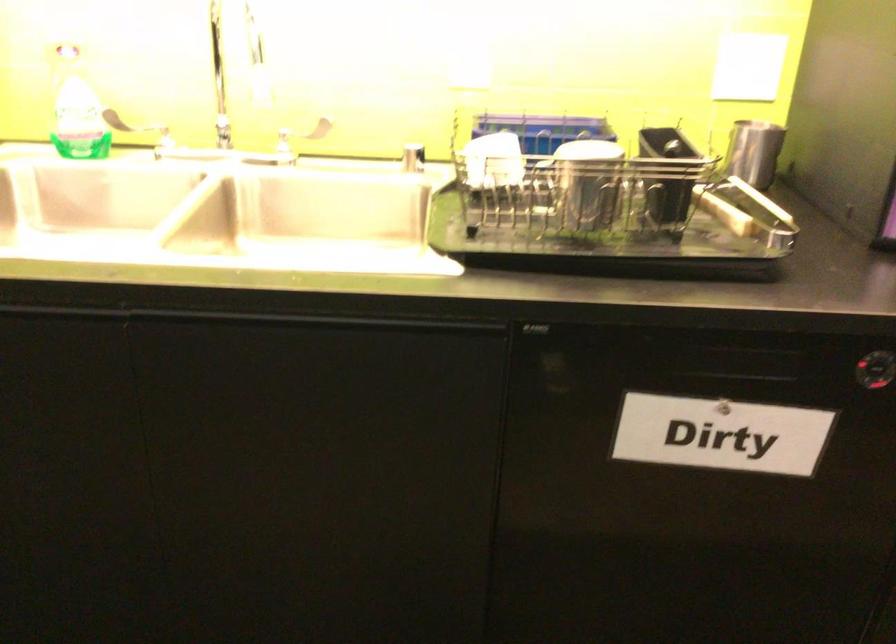
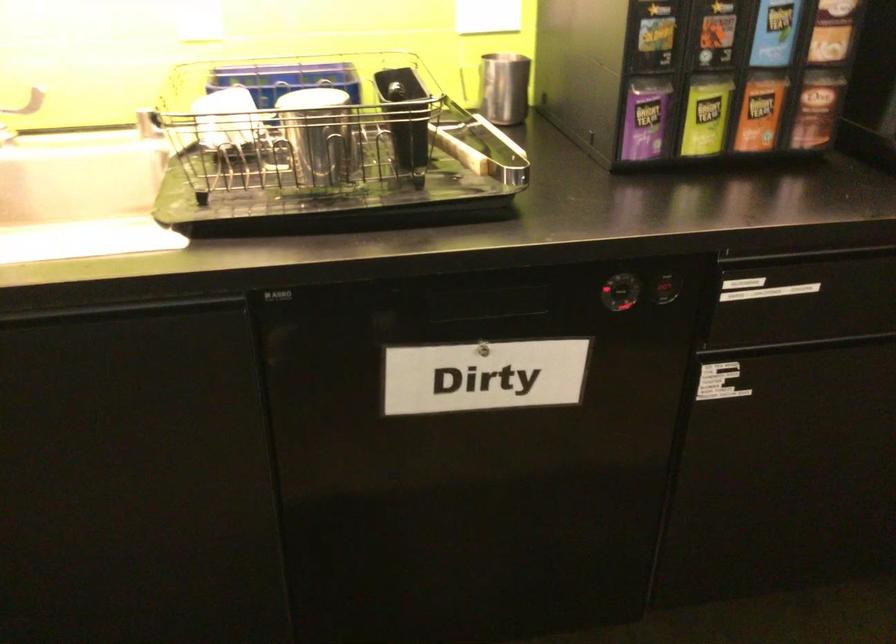
In the second image, find the point that corresponds to (x=591, y=184) in the first image.

(319, 134)